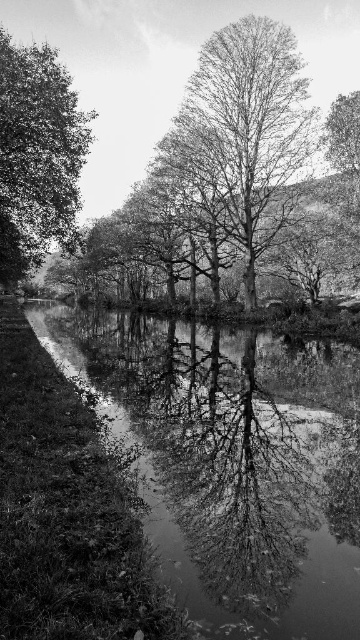
Question: Does bare wood tree at center have a smaller size compared to dark green leafy tree at left?

Choices:
 (A) yes
 (B) no

Answer: (A)

Question: Is bare wood tree at center to the left of dark green leafy tree at left from the viewer's perspective?

Choices:
 (A) no
 (B) yes

Answer: (A)

Question: Among these points, which one is nearest to the camera?

Choices:
 (A) (254, 88)
 (B) (56, 156)

Answer: (B)

Question: Which point is closer to the camera taking this photo?

Choices:
 (A) (72, 204)
 (B) (180, 112)

Answer: (A)

Question: Does bare wood tree at center appear over dark green leafy tree at left?

Choices:
 (A) yes
 (B) no

Answer: (B)